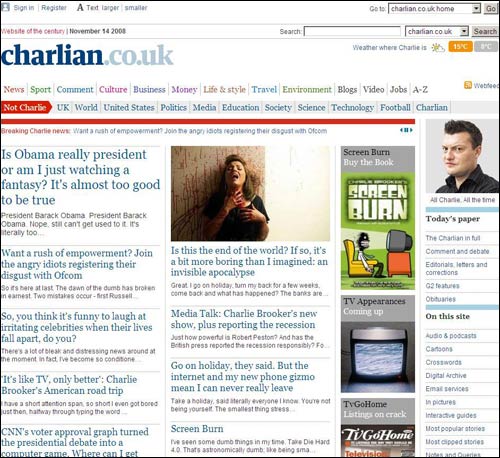
Image resolution: width=500 pixels, height=458 pixels. Find the location of `tv with stand`. tv with stand is located at coordinates (392, 239), (399, 265).